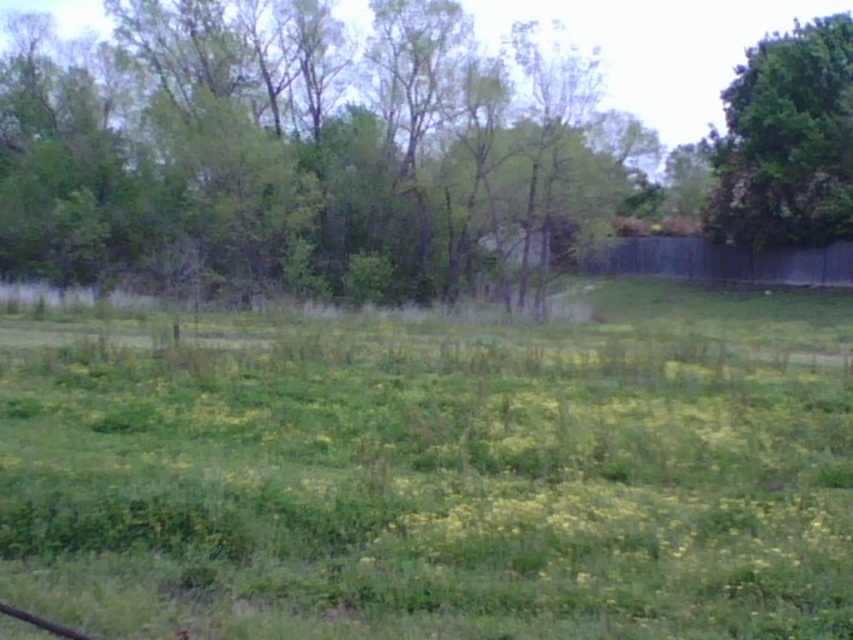
From the picture: You are standing in the backyard and see the green leafy tree at upper center and the green leafy tree at upper right. Which tree is located to the right of the other?

The green leafy tree at upper center is positioned on the left side of the green leafy tree at upper right, meaning the green leafy tree at upper right is to the right of the green leafy tree at upper center.